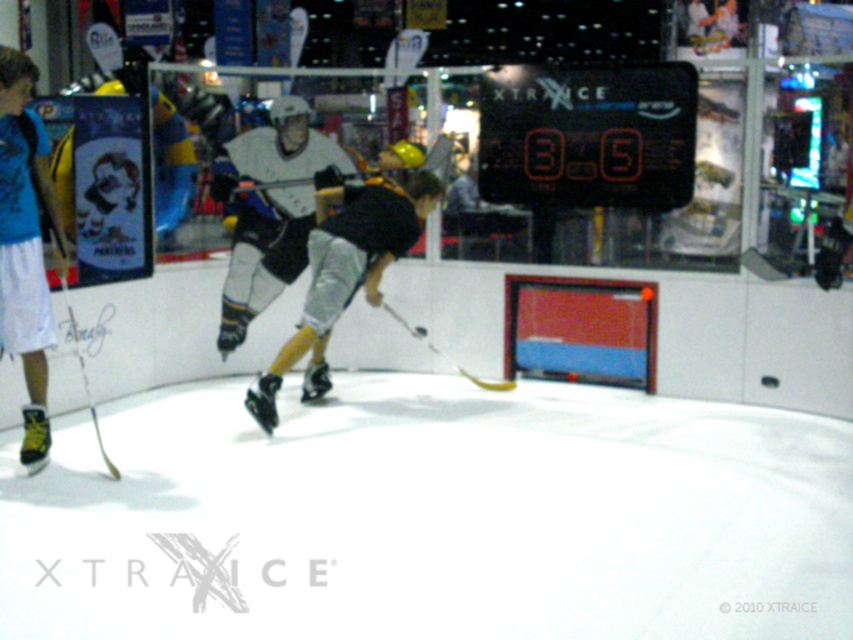
You are an ice hockey player standing at the bottom edge of the rink. You see the white smooth ice at center. In which direction should you move to reach it?

You should move towards the center of the rink to reach the white smooth ice at center.

You are a referee observing the game. You notice two hockey sticks at the center of the ice rink. Which one is taller, the white matte hockey stick at center or the yellow matte hockey stick at center?

The white matte hockey stick at center is much taller than the yellow matte hockey stick at center.